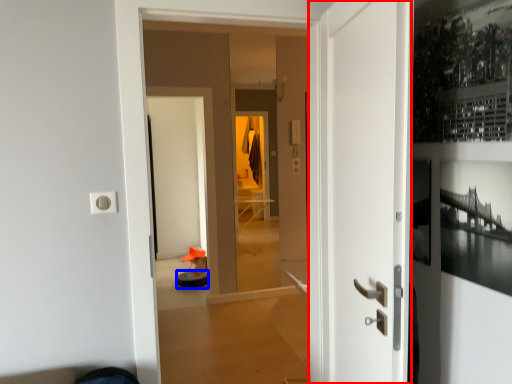
Question: Among these objects, which one is nearest to the camera, door (highlighted by a red box) or furniture (highlighted by a blue box)?

Choices:
 (A) door
 (B) furniture

Answer: (A)